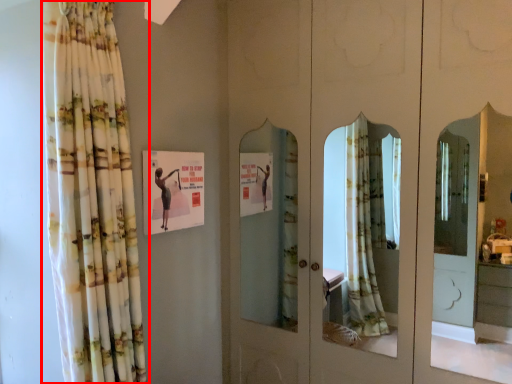
Question: Where is curtain (annotated by the red box) located in relation to postcard in the image?

Choices:
 (A) left
 (B) right

Answer: (A)